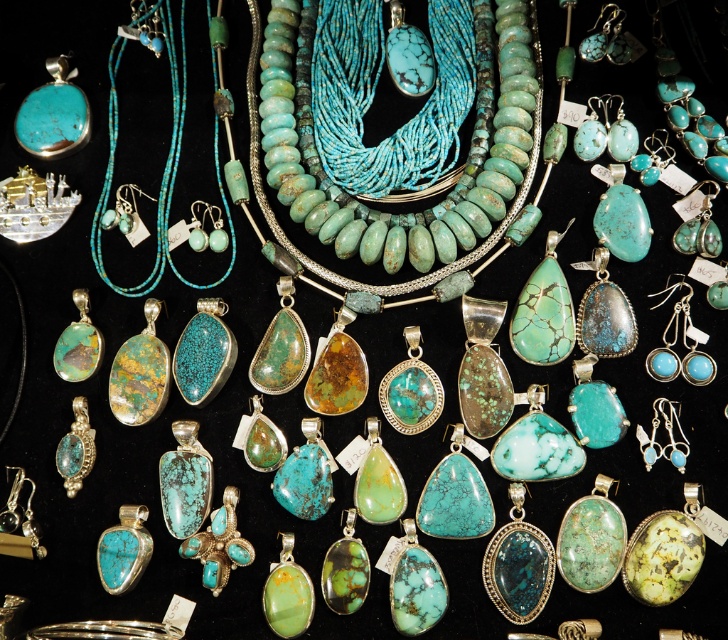
Which is behind, point (331, 100) or point (178, 144)?

The point (178, 144) is more distant.

Between point (486, 26) and point (157, 256), which one is positioned in front?

Point (157, 256)

Is point (317, 6) farther from camera compared to point (174, 113)?

Yes, it is behind point (174, 113).

Find the location of a particular element. This screenshot has height=640, width=728. turquoise stone beads at center is located at coordinates (403, 141).